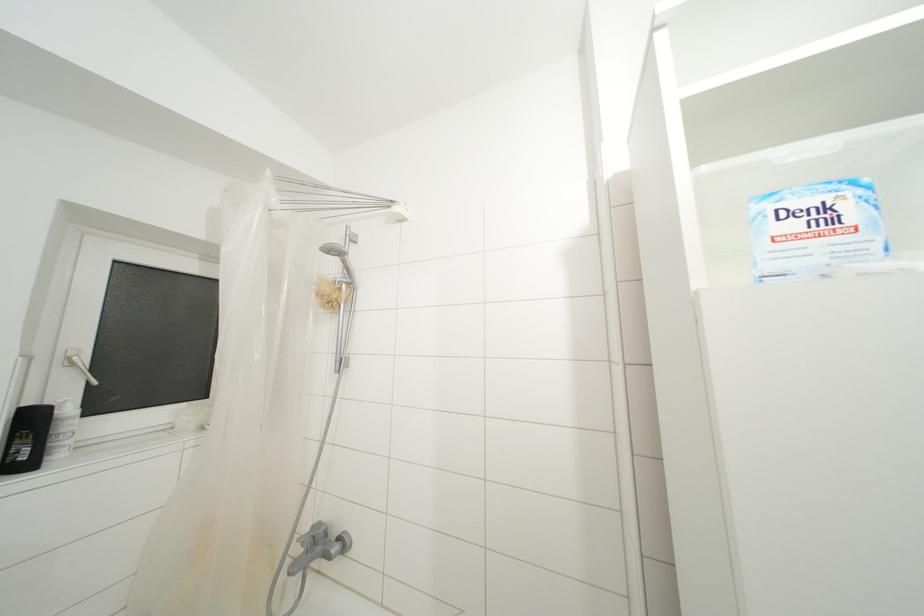
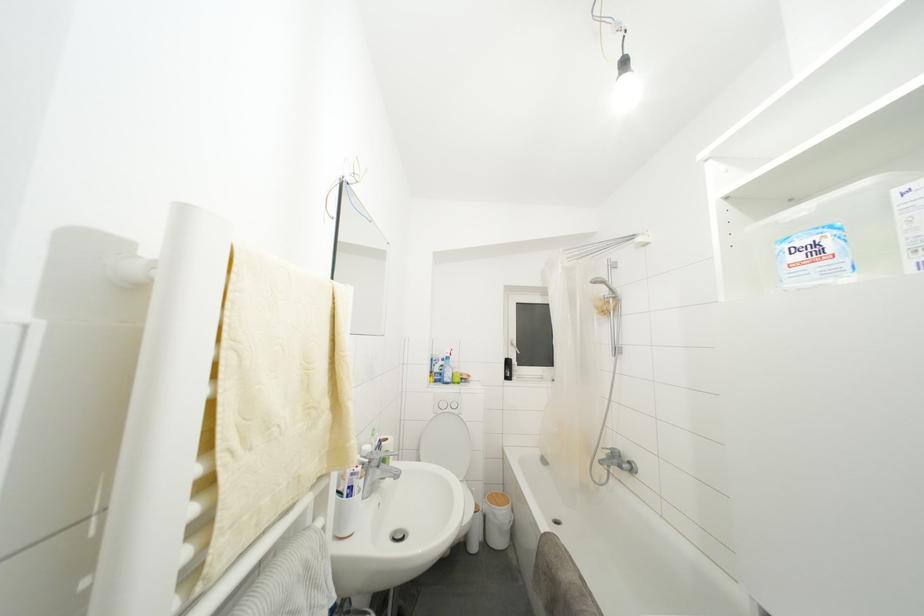
Question: The first image is from the beginning of the video and the second image is from the end. How did the camera likely rotate when shooting the video?

Choices:
 (A) Left
 (B) Right
 (C) Up
 (D) Down

Answer: (A)